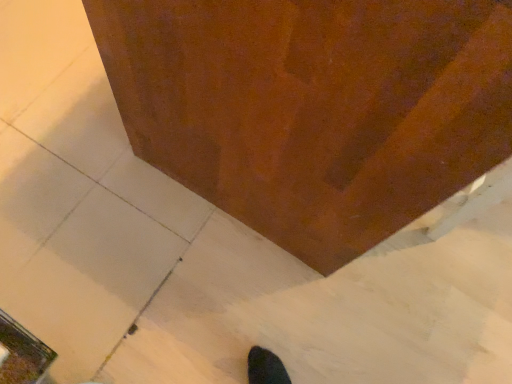
What is the approximate height of rustic wood door at upper center?

32.78 inches.

Find the location of `rustic wood door at upper center`. rustic wood door at upper center is located at coordinates (313, 107).

What do you see at coordinates (313, 107) in the screenshot? Image resolution: width=512 pixels, height=384 pixels. I see `rustic wood door at upper center` at bounding box center [313, 107].

Where is `rustic wood door at upper center`? rustic wood door at upper center is located at coordinates (313, 107).